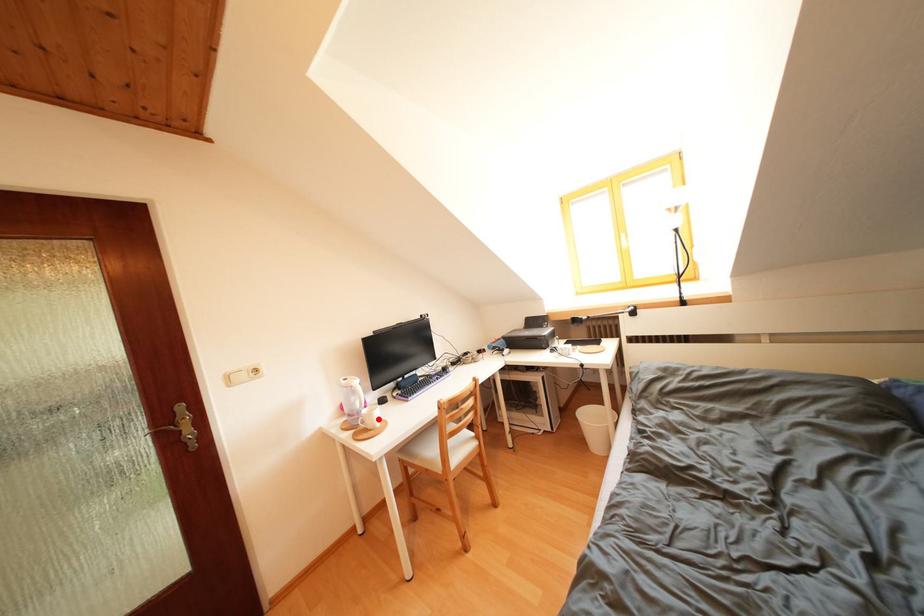
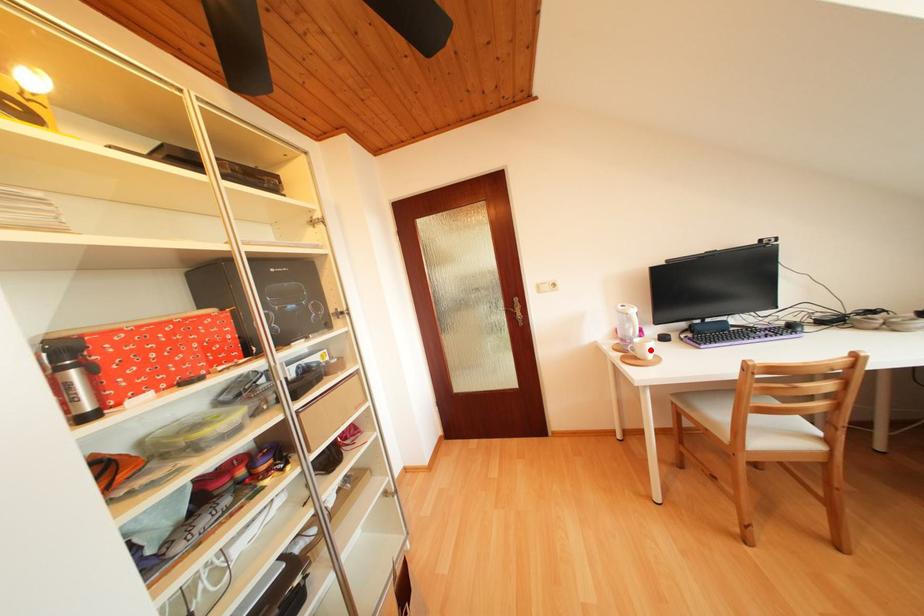
I am providing you with two images of the same scene from different viewpoints. A red point is marked on the first image and another point is marked on the second image. Is the marked point in image1 the same physical position as the marked point in image2?

Yes